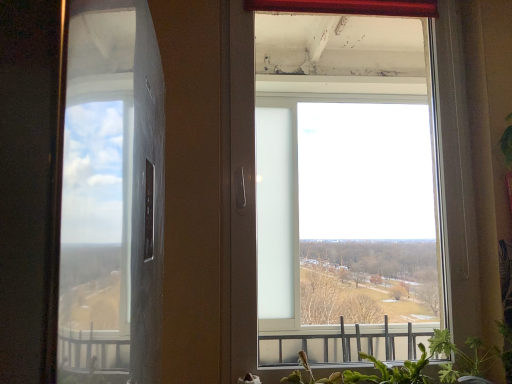
Question: Is point (257, 352) positioned closer to the camera than point (418, 372)?

Choices:
 (A) closer
 (B) farther

Answer: (B)

Question: In terms of width, does transparent glass window at center look wider or thinner when compared to green leafy plant at lower right, acting as the 2th plant starting from the right?

Choices:
 (A) thin
 (B) wide

Answer: (A)

Question: Which object is the closest to the green leafy plant at lower right, which is counted as the second plant, starting from the left?

Choices:
 (A) transparent glass window at center
 (B) green leafy plant at lower right, placed as the 1th plant when sorted from left to right

Answer: (B)

Question: Considering the real-world distances, which object is closest to the green leafy plant at lower right, acting as the 2th plant starting from the right?

Choices:
 (A) transparent glass window at center
 (B) green leafy plant at lower right, arranged as the 1th plant when viewed from the right

Answer: (B)